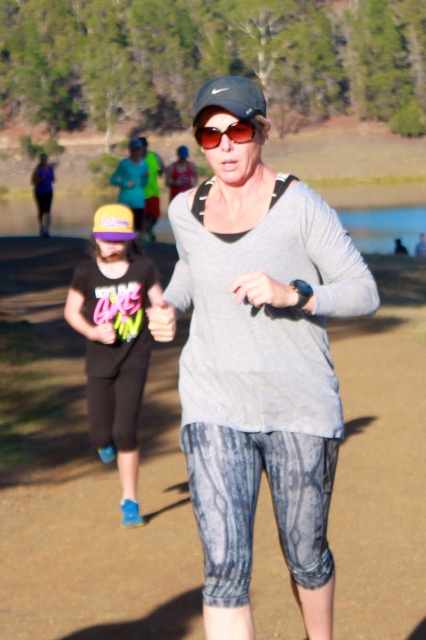
Question: Can you confirm if black matte shirt at center is positioned to the left of shiny red sunglasses at center?

Choices:
 (A) yes
 (B) no

Answer: (A)

Question: Does matte gray shirt at center lie behind neon green shirt at center?

Choices:
 (A) yes
 (B) no

Answer: (B)

Question: Which object is the closest to the matte gray shirt at center?

Choices:
 (A) black matte shirt at center
 (B) neon green shirt at center

Answer: (B)

Question: Which point is farther to the camera?

Choices:
 (A) black matte shirt at center
 (B) matte purple tank top at upper left

Answer: (B)

Question: Which point is closer to the camera taking this photo?

Choices:
 (A) (141, 140)
 (B) (252, 128)
 (C) (106, 211)

Answer: (B)

Question: Can you confirm if black matte shirt at center is positioned below matte purple tank top at upper left?

Choices:
 (A) yes
 (B) no

Answer: (A)